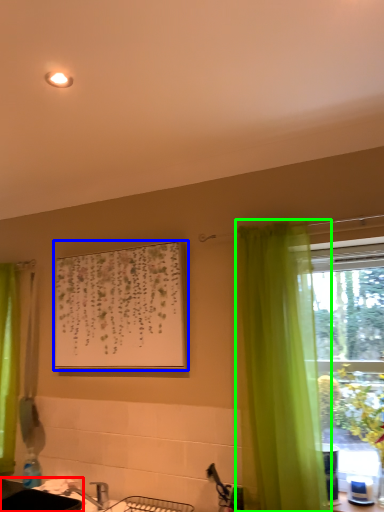
Question: Which is nearer to the sink (highlighted by a red box)? picture frame (highlighted by a blue box) or curtain (highlighted by a green box).

Choices:
 (A) picture frame
 (B) curtain

Answer: (A)